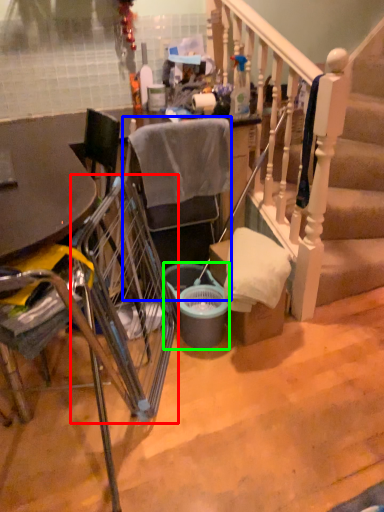
Question: Which object is positioned farthest from trolley (highlighted by a red box)? Select from chair (highlighted by a blue box) and bucket (highlighted by a green box).

Choices:
 (A) chair
 (B) bucket

Answer: (A)